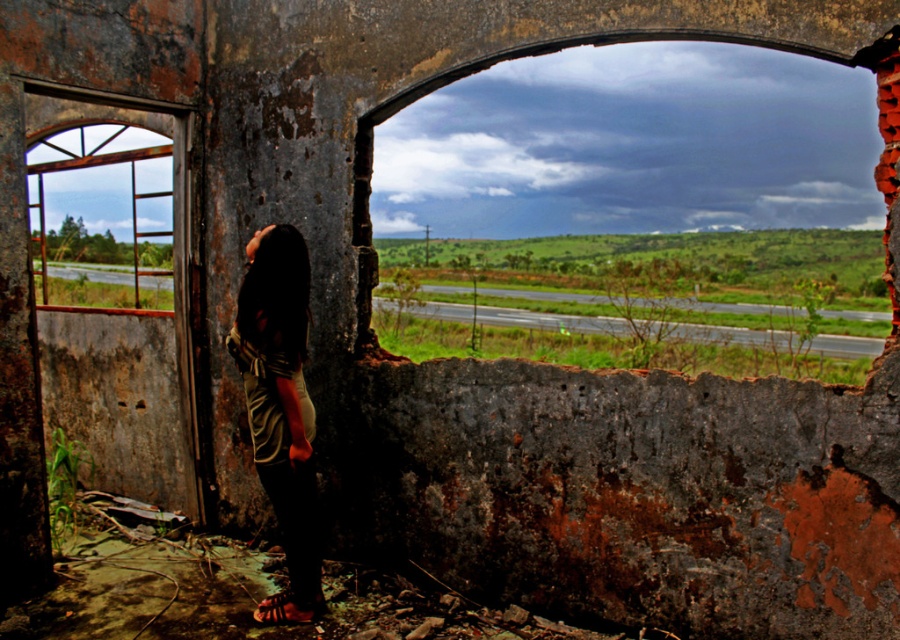
Based on the photo, you are standing at the point labeled point (x=289, y=600) in the image. You want to move to the point labeled point (x=140, y=168). Will you be moving towards or away from the weathered wall with peeling paint and exposed bricks?

Since point (x=140, y=168) is behind point (x=289, y=600), moving from point (x=289, y=600) to point (x=140, y=168) would mean moving away from the weathered wall with peeling paint and exposed bricks.

You are a photographer trying to capture the rusty metal window at left and the leather sandal at lower center in the same frame. Which object should you adjust your camera to focus on first if you want to include both in your shot?

The rusty metal window at left is positioned on the left side of the leather sandal at lower center, so you should focus on the rusty metal window at left first to ensure both are in frame.